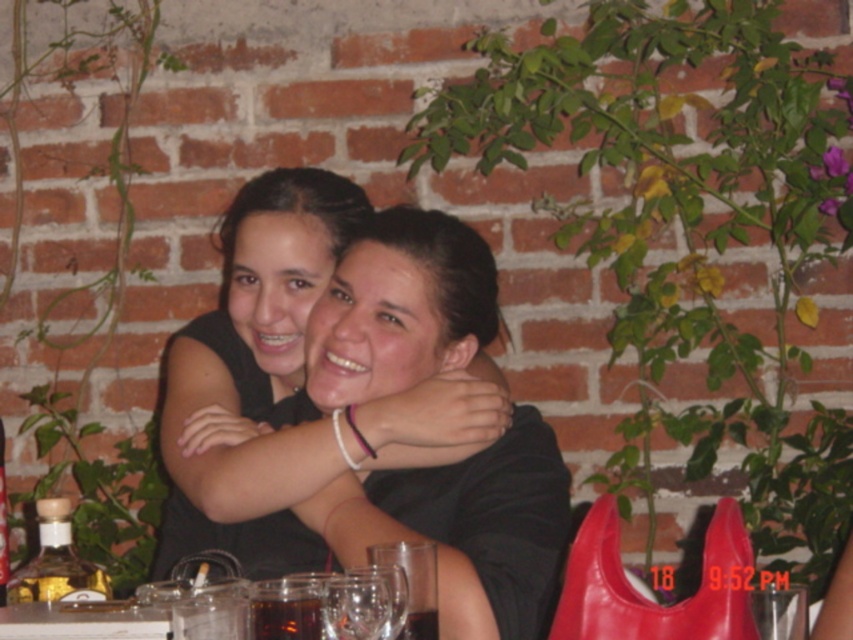
Question: Which of the following is the farthest from the observer?

Choices:
 (A) (383, 636)
 (B) (415, 620)

Answer: (B)

Question: From the image, what is the correct spatial relationship of black matte shirt at center in relation to translucent glass bottle at lower left?

Choices:
 (A) left
 (B) right

Answer: (B)

Question: Which object appears closest to the camera in this image?

Choices:
 (A) transparent glass wine glass at center
 (B) transparent glass wine glass at lower center
 (C) black matte shirt at center
 (D) transparent glass at center

Answer: (D)

Question: Is transparent glass at lower center smaller than transparent glass at center?

Choices:
 (A) yes
 (B) no

Answer: (A)

Question: Is transparent glass at lower center smaller than transparent glass at center?

Choices:
 (A) yes
 (B) no

Answer: (A)

Question: Estimate the real-world distances between objects in this image. Which object is closer to the transparent glass wine glass at lower center?

Choices:
 (A) translucent glass bottle at lower left
 (B) transparent glass at lower center
 (C) transparent glass wine glass at center

Answer: (C)